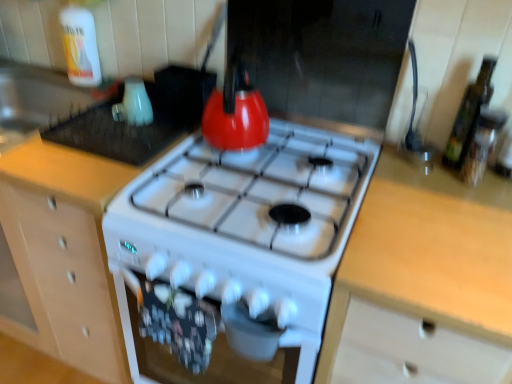
Image resolution: width=512 pixels, height=384 pixels. Find the location of `free location to the right of white glossy kettle at upper left, the 1th appliance when ordered from left to right`. free location to the right of white glossy kettle at upper left, the 1th appliance when ordered from left to right is located at coordinates (164, 122).